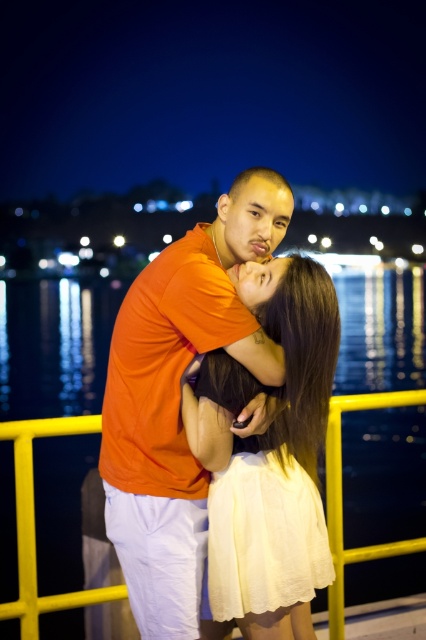
Between orange matte shirt at center and matte white dress at center, which one is positioned lower?

Positioned lower is matte white dress at center.

Describe the element at coordinates (178, 397) in the screenshot. I see `orange matte shirt at center` at that location.

Describe the element at coordinates (178, 397) in the screenshot. This screenshot has width=426, height=640. I see `orange matte shirt at center` at that location.

Locate an element on the screen. Image resolution: width=426 pixels, height=640 pixels. orange matte shirt at center is located at coordinates (178, 397).

This screenshot has height=640, width=426. Find the location of `orange matte shirt at center`. orange matte shirt at center is located at coordinates (178, 397).

You are a GUI agent. You are given a task and a screenshot of the screen. Output one action in this format:
    pyautogui.click(x=<x>, y=<y>)
    Task: Click on the orange matte shirt at center
    This screenshot has width=426, height=640.
    Given the screenshot: What is the action you would take?
    pyautogui.click(x=178, y=397)

Can you confirm if matte white dress at center is positioned to the right of yellow metal railing at lower center?

In fact, matte white dress at center is to the left of yellow metal railing at lower center.

Which of these two, matte white dress at center or yellow metal railing at lower center, stands taller?

matte white dress at center

Who is more distant from viewer, (324, 324) or (371, 396)?

Positioned behind is point (371, 396).

I want to click on matte white dress at center, so click(x=284, y=360).